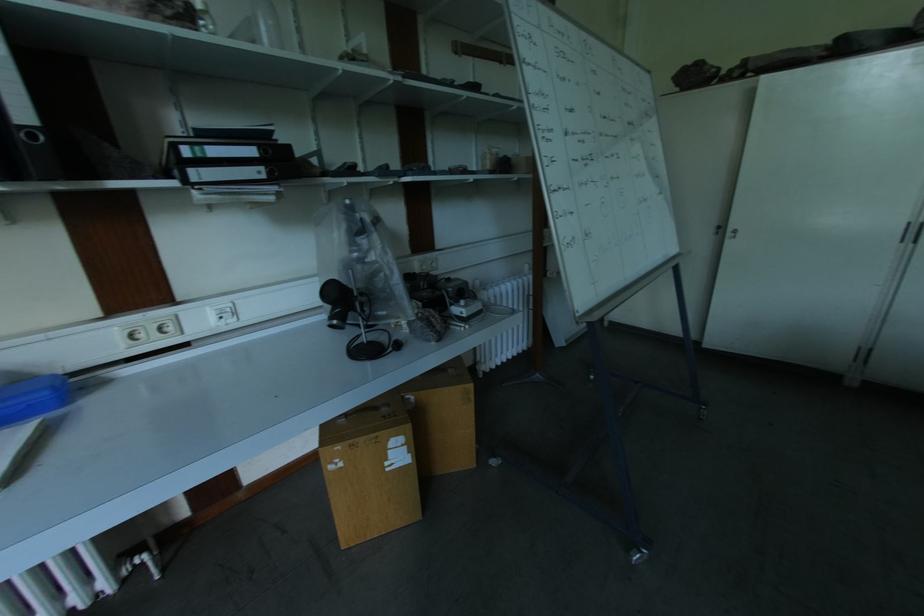
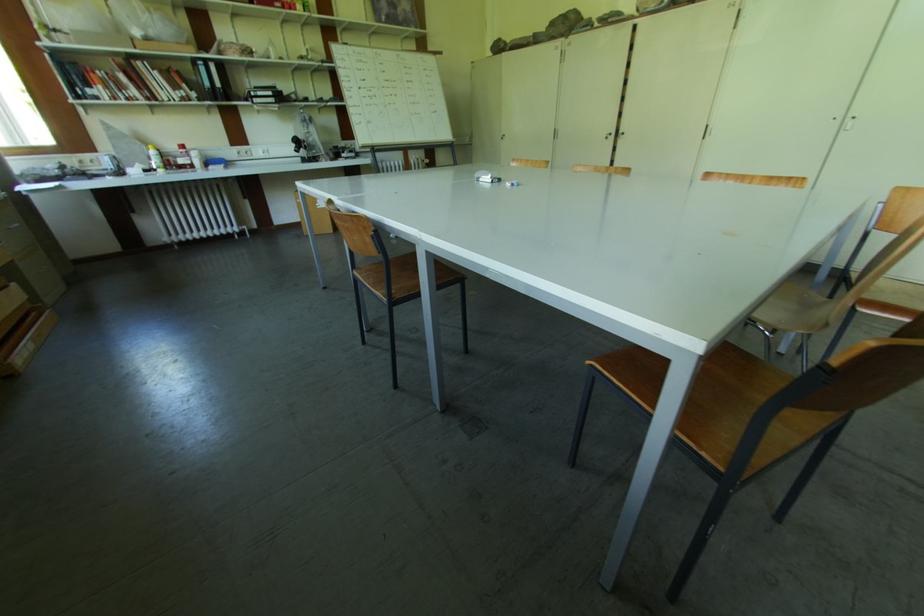
Which direction would the cameraman need to move to produce the second image?

The cameraman walked toward right, backward.